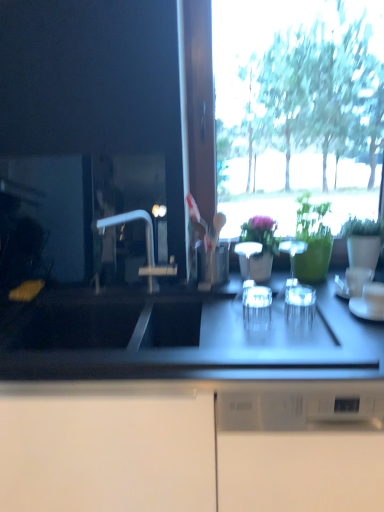
What do you see at coordinates (257, 308) in the screenshot?
I see `clear glass at center, positioned as the 6th tableware in right-to-left order` at bounding box center [257, 308].

What do you see at coordinates (353, 282) in the screenshot?
I see `white glossy cup at right, the sixth tableware from the left` at bounding box center [353, 282].

The height and width of the screenshot is (512, 384). Describe the element at coordinates (366, 309) in the screenshot. I see `white glossy cup at center, which is counted as the 3th tableware, starting from the right` at that location.

The image size is (384, 512). Find the location of `green matte vase at center, which is counted as the 1th houseplant, starting from the left`. green matte vase at center, which is counted as the 1th houseplant, starting from the left is located at coordinates (262, 247).

Describe the element at coordinates (262, 247) in the screenshot. I see `green matte vase at center, marked as the second houseplant in a right-to-left arrangement` at that location.

Describe the element at coordinates (292, 251) in the screenshot. I see `clear glass wine glasses at center, acting as the 2th tableware starting from the left` at that location.

The height and width of the screenshot is (512, 384). What do you see at coordinates (300, 309) in the screenshot?
I see `transparent glass at center, which is counted as the 3th tableware, starting from the left` at bounding box center [300, 309].

You are a GUI agent. You are given a task and a screenshot of the screen. Output one action in this format:
    pyautogui.click(x=<x>, y=<y>)
    Task: Click on the clear glass at center, positioned as the 6th tableware in right-to-left order
    The height and width of the screenshot is (512, 384).
    Given the screenshot: What is the action you would take?
    pyautogui.click(x=257, y=308)

Which of these two, transparent glass at center, which is counted as the 3th tableware, starting from the left, or clear glass wine glasses at center, positioned as the 5th tableware in right-to-left order, is wider?

transparent glass at center, which is counted as the 3th tableware, starting from the left.

Find the location of a particular element. Image resolution: width=384 pixels, height=512 pixels. tableware that is the 2nd object located in front of the clear glass wine glasses at center, acting as the 2th tableware starting from the left is located at coordinates (300, 309).

Can we say transparent glass at center, which is counted as the 3th tableware, starting from the left, lies outside clear glass wine glasses at center, positioned as the 5th tableware in right-to-left order?

Yes, transparent glass at center, which is counted as the 3th tableware, starting from the left, is not within clear glass wine glasses at center, positioned as the 5th tableware in right-to-left order.

Considering the relative positions of transparent glass at center, arranged as the fourth tableware when viewed from the right, and clear glass wine glasses at center, positioned as the 5th tableware in right-to-left order, in the image provided, is transparent glass at center, arranged as the fourth tableware when viewed from the right, behind clear glass wine glasses at center, positioned as the 5th tableware in right-to-left order,?

No.

Does transparent glass at center, arranged as the fourth tableware when viewed from the right, lie behind white glossy cup at right, the sixth tableware from the left?

No.

Identify the location of the 2nd tableware positioned above the transparent glass at center, arranged as the fourth tableware when viewed from the right (from a real-world perspective). (353, 282).

Is transparent glass at center, arranged as the fourth tableware when viewed from the right, in contact with white glossy cup at right, the sixth tableware from the left?

transparent glass at center, arranged as the fourth tableware when viewed from the right, and white glossy cup at right, the sixth tableware from the left, are clearly separated.

Which of these two, transparent glass at center, which is counted as the 3th tableware, starting from the left, or white glossy cup at right, the sixth tableware from the left, is wider?

Wider between the two is transparent glass at center, which is counted as the 3th tableware, starting from the left.

Is clear glass at center, placed as the 1th tableware when sorted from left to right, thinner than clear glass wine glasses at center, positioned as the 5th tableware in right-to-left order?

No.

Considering the relative sizes of clear glass at center, positioned as the 6th tableware in right-to-left order, and clear glass wine glasses at center, acting as the 2th tableware starting from the left, in the image provided, is clear glass at center, positioned as the 6th tableware in right-to-left order, taller than clear glass wine glasses at center, acting as the 2th tableware starting from the left,?

No.

From the picture: From the image's perspective, relative to clear glass wine glasses at center, acting as the 2th tableware starting from the left, is clear glass at center, positioned as the 6th tableware in right-to-left order, above or below?

From the image's perspective, clear glass at center, positioned as the 6th tableware in right-to-left order, appears below clear glass wine glasses at center, acting as the 2th tableware starting from the left.

There is a white glossy cup at right, the sixth tableware from the left. Where is `the 1st houseplant above it (from a real-world perspective)`? This screenshot has width=384, height=512. the 1st houseplant above it (from a real-world perspective) is located at coordinates (262, 247).

From a real-world perspective, does green matte vase at center, which is counted as the 1th houseplant, starting from the left, stand above white glossy cup at right, the sixth tableware from the left?

Indeed, from a real-world perspective, green matte vase at center, which is counted as the 1th houseplant, starting from the left, stands above white glossy cup at right, the sixth tableware from the left.

Is green matte vase at center, marked as the second houseplant in a right-to-left arrangement, oriented away from white glossy cup at right, the sixth tableware from the left?

No, green matte vase at center, marked as the second houseplant in a right-to-left arrangement, is not facing the opposite direction of white glossy cup at right, the sixth tableware from the left.

In terms of width, does green matte vase at center, marked as the second houseplant in a right-to-left arrangement, look wider or thinner when compared to white glossy cup at right, the sixth tableware from the left?

Clearly, green matte vase at center, marked as the second houseplant in a right-to-left arrangement, has more width compared to white glossy cup at right, the sixth tableware from the left.

From a real-world perspective, which is physically above, white glossy cup at center, which is counted as the 3th tableware, starting from the right, or green matte vase at center, which is counted as the 1th houseplant, starting from the left?

green matte vase at center, which is counted as the 1th houseplant, starting from the left, is physically above.

Is white glossy cup at center, the fourth tableware viewed from the left, beside green matte vase at center, which is counted as the 1th houseplant, starting from the left?

white glossy cup at center, the fourth tableware viewed from the left, is not next to green matte vase at center, which is counted as the 1th houseplant, starting from the left, and they're not touching.

Which object is closer to the camera, white glossy cup at center, the fourth tableware viewed from the left, or green matte vase at center, marked as the second houseplant in a right-to-left arrangement?

white glossy cup at center, the fourth tableware viewed from the left, is in front.

Is white glossy cup at center, which is counted as the 3th tableware, starting from the right, facing towards green matte vase at center, which is counted as the 1th houseplant, starting from the left?

No, white glossy cup at center, which is counted as the 3th tableware, starting from the right, is not oriented towards green matte vase at center, which is counted as the 1th houseplant, starting from the left.

Does white glossy cup at right, the first tableware positioned from the right, have a lesser width compared to green matte vase at center, which is counted as the 1th houseplant, starting from the left?

Indeed, white glossy cup at right, the first tableware positioned from the right, has a lesser width compared to green matte vase at center, which is counted as the 1th houseplant, starting from the left.

From the green matte vase at center, marked as the second houseplant in a right-to-left arrangement, count 1st tablewares forward and point to it. Please provide its 2D coordinates.

[(353, 282)]

Is green matte vase at center, marked as the second houseplant in a right-to-left arrangement, completely or partially inside white glossy cup at right, the sixth tableware from the left?

No, green matte vase at center, marked as the second houseplant in a right-to-left arrangement, is not inside white glossy cup at right, the sixth tableware from the left.

Which object is closer to the camera, white glossy cup at right, the first tableware positioned from the right, or green matte vase at center, which is counted as the 1th houseplant, starting from the left?

white glossy cup at right, the first tableware positioned from the right.

Considering the sizes of objects clear glass wine glasses at center, positioned as the 5th tableware in right-to-left order, and white glossy cup at center, which is counted as the 3th tableware, starting from the right, in the image provided, who is wider, clear glass wine glasses at center, positioned as the 5th tableware in right-to-left order, or white glossy cup at center, which is counted as the 3th tableware, starting from the right,?

With larger width is white glossy cup at center, which is counted as the 3th tableware, starting from the right.

Is point (282, 244) closer to camera compared to point (382, 310)?

No.

At what (x,y) coordinates should I click in order to perform the action: click on tableware that is the 5th one above the white glossy cup at center, which is counted as the 3th tableware, starting from the right (from a real-world perspective). Please return your answer as a coordinate pair (x, y). Looking at the image, I should click on (292, 251).

This screenshot has height=512, width=384. Find the location of `tableware that is the 2nd one when counting backward from the transparent glass at center, arranged as the fourth tableware when viewed from the right`. tableware that is the 2nd one when counting backward from the transparent glass at center, arranged as the fourth tableware when viewed from the right is located at coordinates (292, 251).

The height and width of the screenshot is (512, 384). I want to click on the 3rd tableware counting from the right side of the transparent glass at center, which is counted as the 3th tableware, starting from the left, so click(353, 282).

Looking at the image, which one is located closer to transparent glass at center, which is counted as the 3th tableware, starting from the left, green matte vase at center, marked as the second houseplant in a right-to-left arrangement, or white glossy cup at right, the sixth tableware from the left?

The object closer to transparent glass at center, which is counted as the 3th tableware, starting from the left, is white glossy cup at right, the sixth tableware from the left.

Which object lies further to the anchor point green matte vase at center, marked as the second houseplant in a right-to-left arrangement, white glossy cup at center, which is counted as the 3th tableware, starting from the right, or clear glass cup at right, the second tableware from the right?

The object further to green matte vase at center, marked as the second houseplant in a right-to-left arrangement, is clear glass cup at right, the second tableware from the right.

Looking at the image, which one is located further to clear glass cup at right, which ranks as the fifth tableware in left-to-right order, transparent glass at center, which is counted as the 3th tableware, starting from the left, or green matte vase at center, marked as the second houseplant in a right-to-left arrangement?

The object further to clear glass cup at right, which ranks as the fifth tableware in left-to-right order, is green matte vase at center, marked as the second houseplant in a right-to-left arrangement.

When comparing their distances from clear glass wine glasses at center, positioned as the 5th tableware in right-to-left order, does clear glass at center, positioned as the 6th tableware in right-to-left order, or white glossy cup at right, the sixth tableware from the left, seem further?

clear glass at center, positioned as the 6th tableware in right-to-left order, is further to clear glass wine glasses at center, positioned as the 5th tableware in right-to-left order.

Considering their positions, is green matte vase at center, which is counted as the 1th houseplant, starting from the left, positioned further to white glossy cup at center, the fourth tableware viewed from the left, than green glossy vase at upper right, which appears as the second houseplant when viewed from the left?

green matte vase at center, which is counted as the 1th houseplant, starting from the left, lies further to white glossy cup at center, the fourth tableware viewed from the left, than the other object.

When comparing their distances from white glossy cup at center, the fourth tableware viewed from the left, does clear glass cup at right, which ranks as the fifth tableware in left-to-right order, or green glossy vase at upper right, the 1th houseplant viewed from the right, seem further?

Among the two, green glossy vase at upper right, the 1th houseplant viewed from the right, is located further to white glossy cup at center, the fourth tableware viewed from the left.

From the image, which object appears to be nearer to green glossy vase at upper right, the 1th houseplant viewed from the right, clear glass at center, positioned as the 6th tableware in right-to-left order, or transparent glass at center, arranged as the fourth tableware when viewed from the right?

Among the two, transparent glass at center, arranged as the fourth tableware when viewed from the right, is located nearer to green glossy vase at upper right, the 1th houseplant viewed from the right.

Estimate the real-world distances between objects in this image. Which object is further from white glossy cup at center, which is counted as the 3th tableware, starting from the right, clear glass cup at right, the second tableware from the right, or clear glass at center, positioned as the 6th tableware in right-to-left order?

clear glass at center, positioned as the 6th tableware in right-to-left order, is positioned further to the anchor white glossy cup at center, which is counted as the 3th tableware, starting from the right.

The image size is (384, 512). In order to click on tableware situated between clear glass wine glasses at center, acting as the 2th tableware starting from the left, and white glossy cup at center, which is counted as the 3th tableware, starting from the right, from left to right in this screenshot , I will do `click(300, 309)`.

Locate an element on the screen. Image resolution: width=384 pixels, height=512 pixels. tableware between clear glass at center, placed as the 1th tableware when sorted from left to right, and transparent glass at center, arranged as the fourth tableware when viewed from the right, from left to right is located at coordinates (292, 251).

The image size is (384, 512). I want to click on houseplant situated between transparent glass at center, arranged as the fourth tableware when viewed from the right, and white glossy cup at right, the first tableware positioned from the right, from left to right, so click(312, 240).

Locate an element on the screen. This screenshot has width=384, height=512. houseplant between transparent glass at center, which is counted as the 3th tableware, starting from the left, and green matte vase at center, marked as the second houseplant in a right-to-left arrangement, along the z-axis is located at coordinates (312, 240).